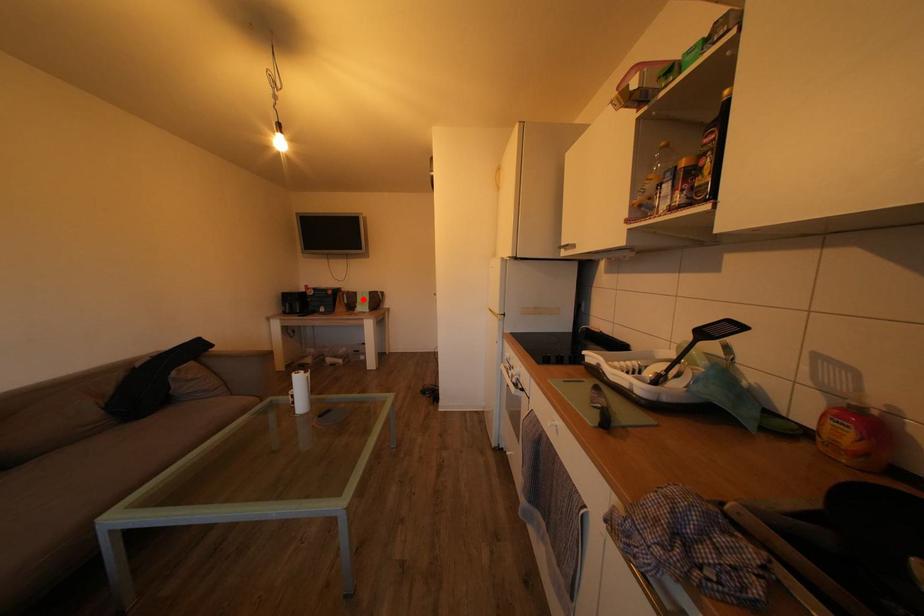
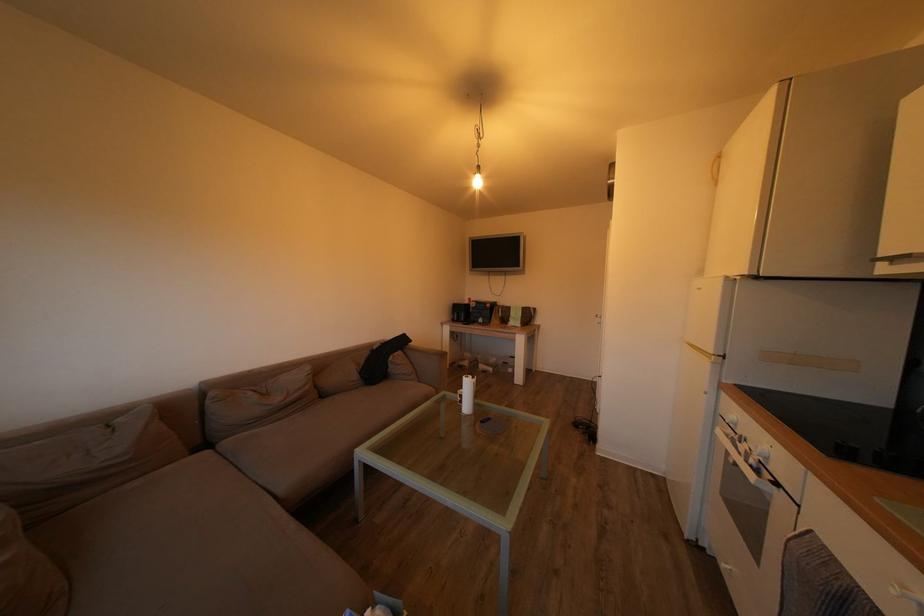
Question: I am providing you with two images of the same scene from different viewpoints. Image1 has a red point marked. In image2, the corresponding 3D location appears at what relative position? Reply with the corresponding letter.

Choices:
 (A) Closer
 (B) Farther

Answer: (B)